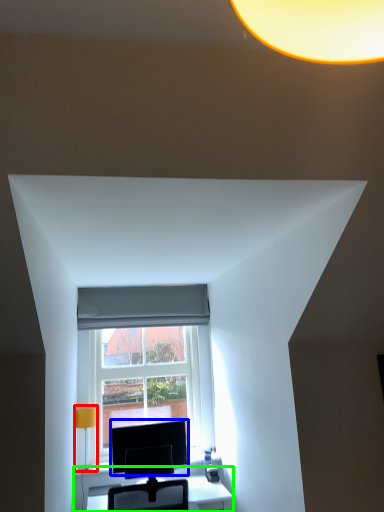
Question: Based on their relative distances, which object is nearer to table lamp (highlighted by a red box)? Choose from computer monitor (highlighted by a blue box) and table (highlighted by a green box).

Choices:
 (A) computer monitor
 (B) table

Answer: (A)